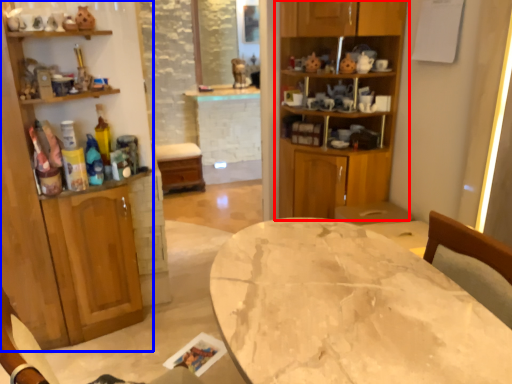
Question: Which object is further to the camera taking this photo, cabinetry (highlighted by a red box) or cabinetry (highlighted by a blue box)?

Choices:
 (A) cabinetry
 (B) cabinetry

Answer: (A)